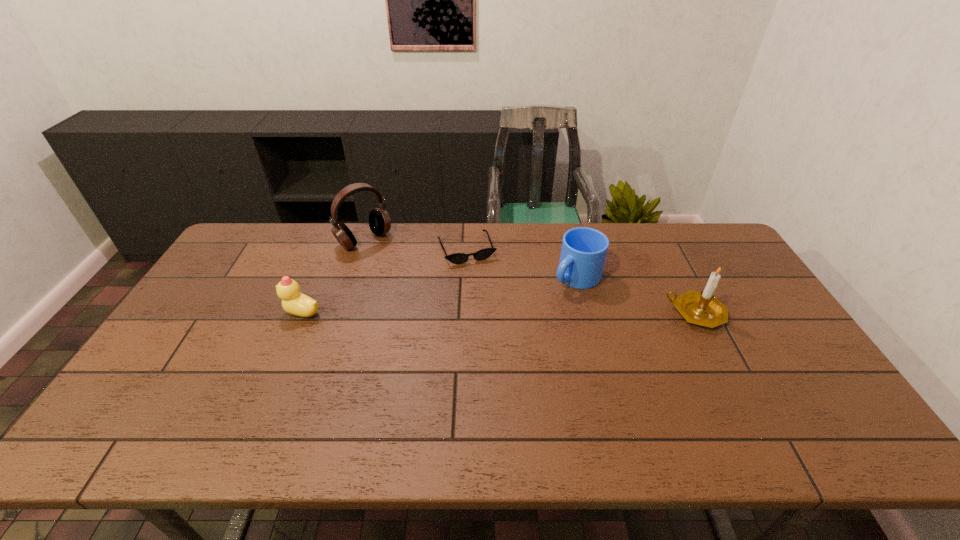
Locate an element on the screen. The width and height of the screenshot is (960, 540). vacant space located on the front-facing side of the shortest object is located at coordinates (480, 281).

Find the location of a particular element. This screenshot has height=540, width=960. free spot located on the front-facing side of the shortest object is located at coordinates (479, 280).

Where is `headset located in the far edge section of the desktop`? headset located in the far edge section of the desktop is located at coordinates (379, 220).

Identify the location of mug situated at the far edge. (583, 254).

You are a GUI agent. You are given a task and a screenshot of the screen. Output one action in this format:
    pyautogui.click(x=<x>, y=<y>)
    Task: Click on the sunglasses positioned at the far edge
    The width and height of the screenshot is (960, 540).
    Given the screenshot: What is the action you would take?
    tap(457, 258)

Image resolution: width=960 pixels, height=540 pixels. I want to click on object that is at the right edge, so click(702, 308).

Identify the location of vacant space at the far edge of the desktop. The width and height of the screenshot is (960, 540). [556, 247].

Locate an element on the screen. blank space at the near edge is located at coordinates 676,392.

Find the location of a particular element. blank space at the left edge of the desktop is located at coordinates (215, 277).

Locate an element on the screen. This screenshot has width=960, height=540. vacant space at the right edge of the desktop is located at coordinates (787, 357).